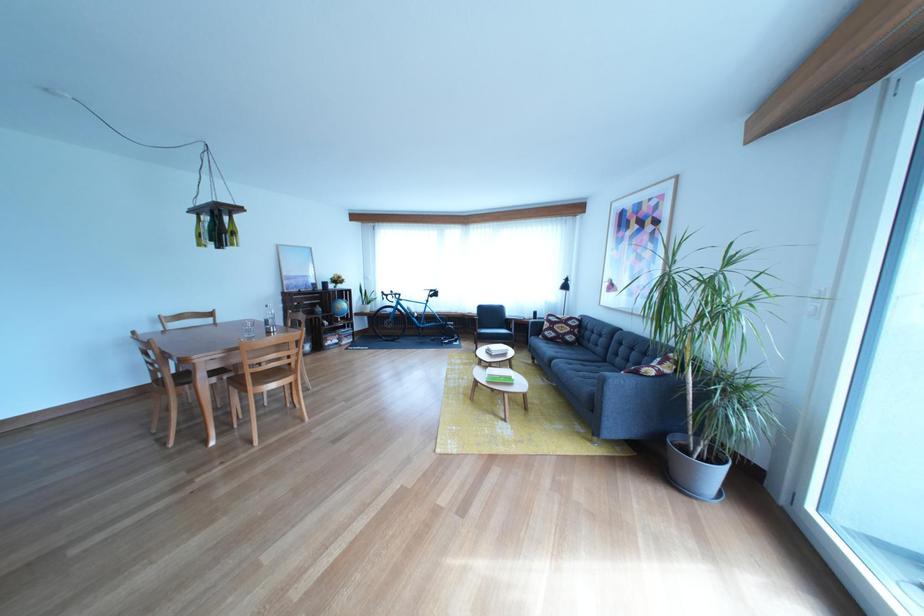
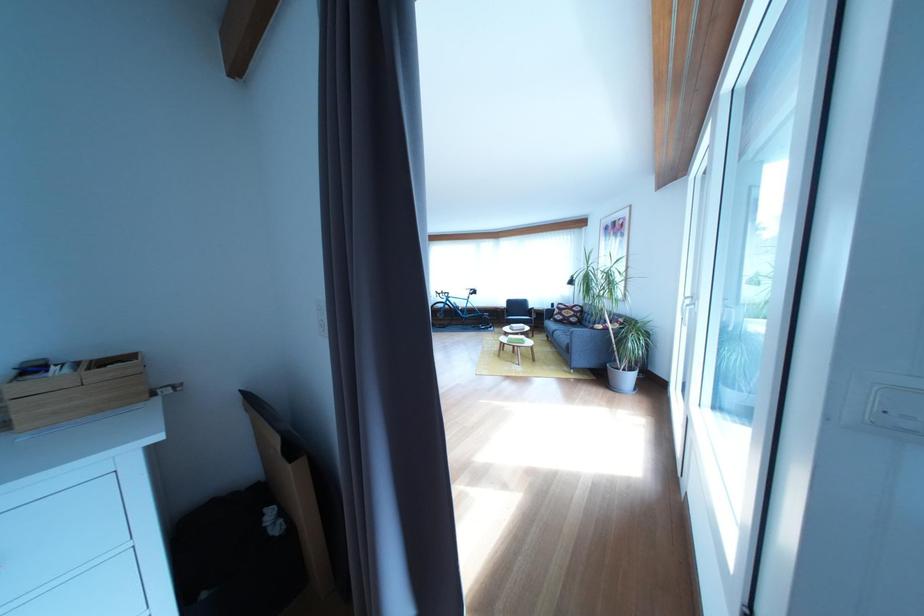
Locate, in the second image, the point that corresponds to (x=581, y=350) in the first image.

(585, 330)